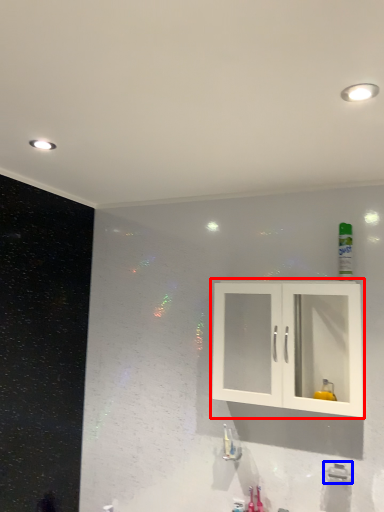
Question: Which object appears closest to the camera in this image, cabinetry (highlighted by a red box) or plumbing fixture (highlighted by a blue box)?

Choices:
 (A) cabinetry
 (B) plumbing fixture

Answer: (A)